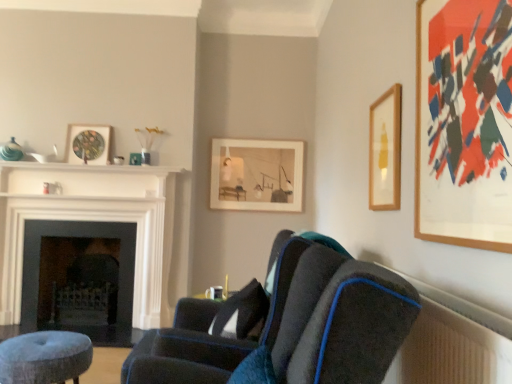
Question: In terms of width, does velvet blue stool at lower left look wider or thinner when compared to white glossy balustrade at upper center?

Choices:
 (A) thin
 (B) wide

Answer: (B)

Question: Relative to white glossy balustrade at upper center, is velvet blue stool at lower left in front or behind?

Choices:
 (A) front
 (B) behind

Answer: (A)

Question: Which object is the closest to the matte glass picture frame at upper left, which is counted as the 3th picture frame, starting from the front?

Choices:
 (A) matte wooden picture frame at center, which is counted as the second picture frame, starting from the left
 (B) white glossy balustrade at upper center
 (C) wooden framed artwork at upper right, the fourth picture frame from the back
 (D) wooden picture frame at upper right, marked as the second picture frame in a right-to-left arrangement
 (E) white glossy fireplace at left, the 2th fireplace positioned from the back

Answer: (B)

Question: Which of these objects is positioned farthest from the dark gray stone fireplace at left, which is the 2th fireplace in front-to-back order?

Choices:
 (A) wooden picture frame at upper right, the 3th picture frame viewed from the back
 (B) white glossy balustrade at upper center
 (C) matte wooden picture frame at center, which appears as the first picture frame when viewed from the back
 (D) velvet dark blue chair at center
 (E) matte glass picture frame at upper left, which is the first picture frame from left to right

Answer: (A)